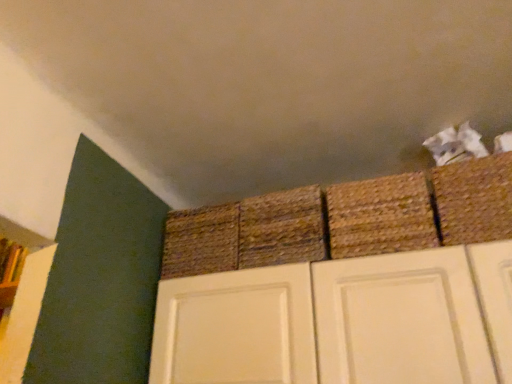
Question: Can wooden shelf at left be found inside rustic woven basket at center, the third basket from the right?

Choices:
 (A) no
 (B) yes

Answer: (A)

Question: Is rustic woven basket at center, positioned as the 2th basket in left-to-right order, bigger than wooden shelf at left?

Choices:
 (A) yes
 (B) no

Answer: (A)

Question: Is rustic woven basket at center, positioned as the 2th basket in left-to-right order, in front of wooden shelf at left?

Choices:
 (A) no
 (B) yes

Answer: (B)

Question: Can you confirm if rustic woven basket at center, positioned as the 2th basket in left-to-right order, is thinner than wooden shelf at left?

Choices:
 (A) no
 (B) yes

Answer: (A)

Question: Is rustic woven basket at center, positioned as the 2th basket in left-to-right order, far away from wooden shelf at left?

Choices:
 (A) no
 (B) yes

Answer: (B)

Question: Can you confirm if rustic woven basket at center, the third basket from the right, is shorter than wooden shelf at left?

Choices:
 (A) yes
 (B) no

Answer: (A)

Question: Is wooden shelf at left touching rustic woven basket at upper right, arranged as the third basket when viewed from the left?

Choices:
 (A) no
 (B) yes

Answer: (A)

Question: Is wooden shelf at left smaller than rustic woven basket at upper right, arranged as the third basket when viewed from the left?

Choices:
 (A) yes
 (B) no

Answer: (A)

Question: Can you confirm if wooden shelf at left is wider than rustic woven basket at upper right, positioned as the 2th basket in right-to-left order?

Choices:
 (A) no
 (B) yes

Answer: (A)

Question: From a real-world perspective, is wooden shelf at left positioned under rustic woven basket at upper right, positioned as the 2th basket in right-to-left order, based on gravity?

Choices:
 (A) yes
 (B) no

Answer: (B)

Question: Is wooden shelf at left surrounding rustic woven basket at upper right, arranged as the third basket when viewed from the left?

Choices:
 (A) yes
 (B) no

Answer: (B)

Question: Is wooden shelf at left looking in the opposite direction of rustic woven basket at upper right, arranged as the third basket when viewed from the left?

Choices:
 (A) no
 (B) yes

Answer: (A)

Question: Can you confirm if rustic woven basket at center, the third basket from the right, is bigger than woven straw basket at center, arranged as the 1th basket when viewed from the left?

Choices:
 (A) yes
 (B) no

Answer: (B)